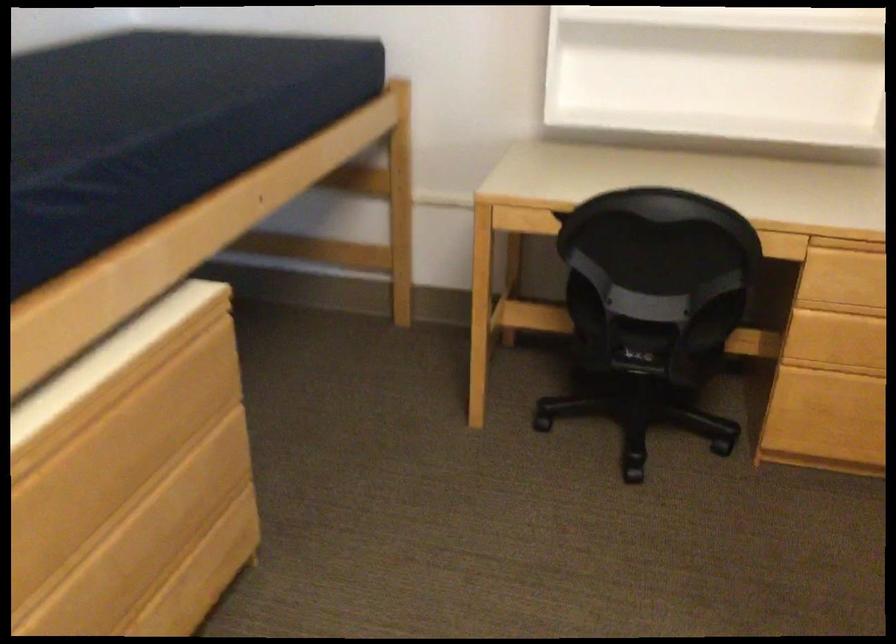
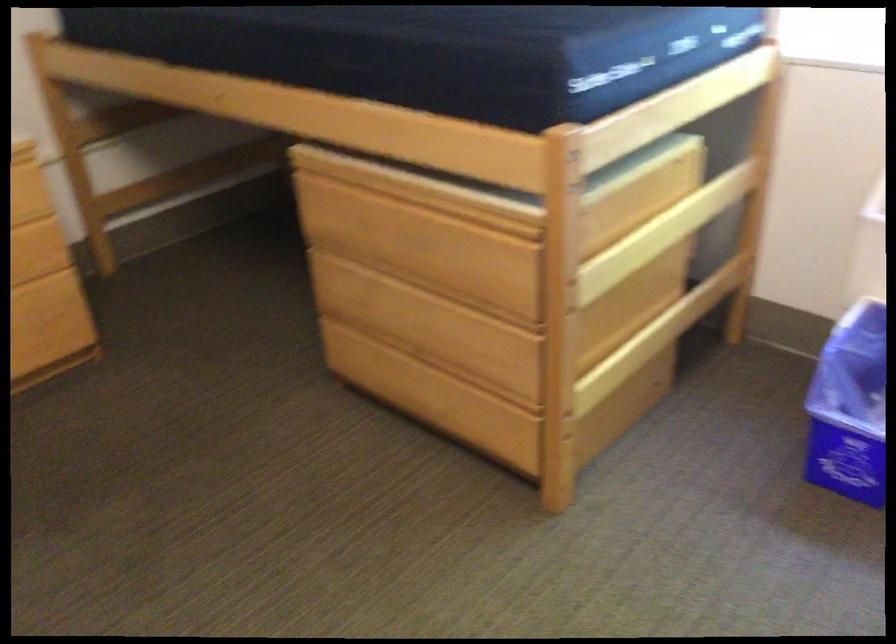
The images are taken continuously from a first-person perspective. In which direction is your viewpoint rotating?

The camera's rotation is toward right-down.